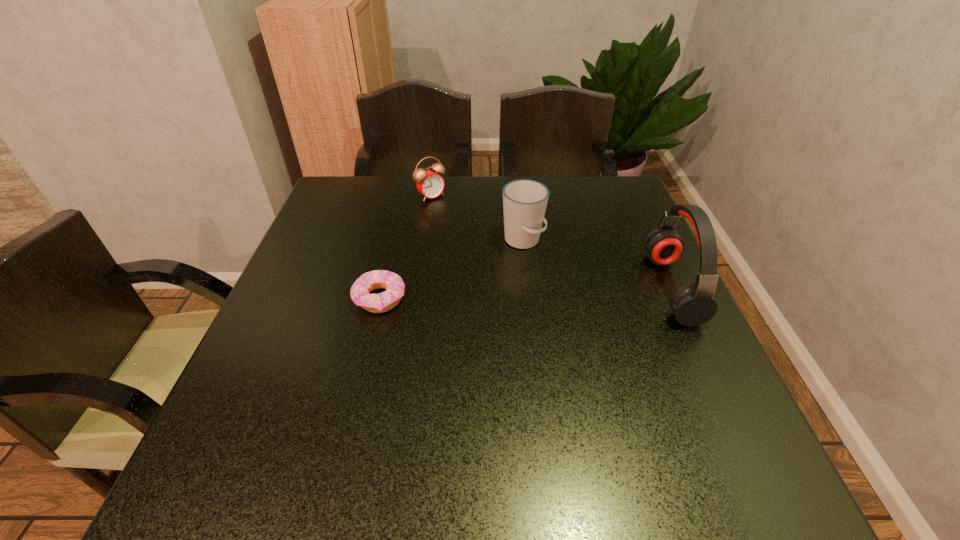
This screenshot has height=540, width=960. Identify the location of the shortest object. (360, 291).

Find the location of `the tallest object`. the tallest object is located at coordinates [x=692, y=304].

Identify the location of earphone. (692, 304).

Find the location of a particular element. alarm clock is located at coordinates [430, 184].

Where is `the farthest object`? The width and height of the screenshot is (960, 540). the farthest object is located at coordinates (430, 184).

Where is `the third shortest object`? the third shortest object is located at coordinates (524, 201).

Where is `the second object from right to left`? This screenshot has width=960, height=540. the second object from right to left is located at coordinates (524, 201).

Locate an element on the screen. This screenshot has width=960, height=540. free space located 0.170m on the front of the shortest object is located at coordinates (359, 384).

Locate an element on the screen. vacant space located on the clock face of the third tallest object is located at coordinates (475, 235).

Find the location of `free space located on the clock face of the third tallest object`. free space located on the clock face of the third tallest object is located at coordinates (516, 273).